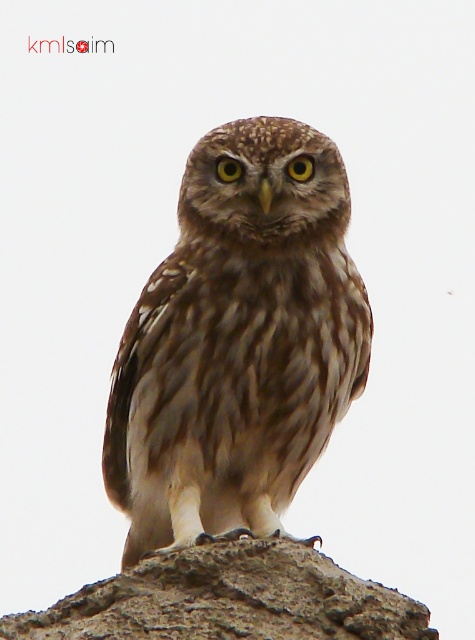
Consider the image. You are a photographer taking a close up of an owl. You notice two points on the owl, one at point (306, 132) and another at point (169, 618). Which point is closer to your camera?

Point (306, 132) is further to the camera than point (169, 618), so the point closer to the camera is point (169, 618).

You are a wildlife photographer aiming to capture the brown speckled owl at center and the gray rough stone at center in a single frame. Given their sizes, will the owl fit entirely within the camera frame if the stone occupies most of the space?

The brown speckled owl at center has a lesser width compared to the gray rough stone at center, so it can fit within the frame even if the stone takes up most of the space.